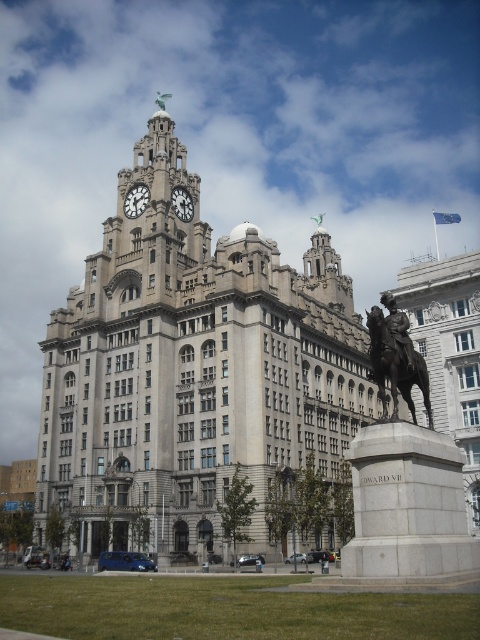
Question: Which of these objects is positioned closest to the shiny bronze horse at center-right?

Choices:
 (A) bronze statue at lower right
 (B) gray stone clock tower at center
 (C) white stone clock at upper center

Answer: (A)

Question: Considering the relative positions of bronze statue at lower right and white stone clock at upper center in the image provided, where is bronze statue at lower right located with respect to white stone clock at upper center?

Choices:
 (A) left
 (B) right

Answer: (B)

Question: Does shiny bronze horse at center-right have a smaller size compared to white stone clock at upper center?

Choices:
 (A) no
 (B) yes

Answer: (A)

Question: Is the position of gray stone clock tower at center less distant than that of white stone clock at upper center?

Choices:
 (A) no
 (B) yes

Answer: (B)

Question: Which of these objects is positioned closest to the gray stone clock tower at center?

Choices:
 (A) white stone clock at center
 (B) white stone clock at upper center
 (C) shiny bronze horse at center-right
 (D) bronze statue at lower right

Answer: (C)

Question: Estimate the real-world distances between objects in this image. Which object is farther from the bronze statue at lower right?

Choices:
 (A) white stone clock at center
 (B) white stone clock at upper center
 (C) gray stone clock tower at center

Answer: (B)